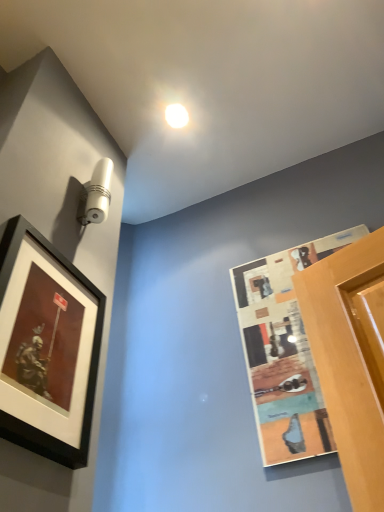
Where is `white glossy droplight at upper center`? This screenshot has height=512, width=384. white glossy droplight at upper center is located at coordinates [x=176, y=115].

The height and width of the screenshot is (512, 384). In order to click on wooden textured picture frame at right, acting as the 1th picture frame starting from the right in this screenshot , I will do `click(284, 351)`.

What is the approximate height of matte black picture frame at left, acting as the 2th picture frame starting from the right?

It is 46.22 centimeters.

The width and height of the screenshot is (384, 512). Find the location of `white glossy droplight at upper center`. white glossy droplight at upper center is located at coordinates (176, 115).

Can you confirm if white glossy droplight at upper center is thinner than wooden textured picture frame at right, acting as the 1th picture frame starting from the right?

No, white glossy droplight at upper center is not thinner than wooden textured picture frame at right, acting as the 1th picture frame starting from the right.

Can you confirm if white glossy droplight at upper center is smaller than wooden textured picture frame at right, which is the second picture frame in left-to-right order?

Yes.

Considering the positions of points (288, 290) and (75, 376), is point (288, 290) farther from camera compared to point (75, 376)?

Yes, it is behind point (75, 376).

Is wooden textured picture frame at right, which is the second picture frame in left-to-right order, shorter than matte black picture frame at left, which is the first picture frame from left to right?

In fact, wooden textured picture frame at right, which is the second picture frame in left-to-right order, may be taller than matte black picture frame at left, which is the first picture frame from left to right.

Between wooden textured picture frame at right, which is the second picture frame in left-to-right order, and matte black picture frame at left, which is the first picture frame from left to right, which one appears on the right side from the viewer's perspective?

From the viewer's perspective, wooden textured picture frame at right, which is the second picture frame in left-to-right order, appears more on the right side.

From the image's perspective, between wooden textured picture frame at right, acting as the 1th picture frame starting from the right, and white glossy droplight at upper center, who is located below?

From the image's view, wooden textured picture frame at right, acting as the 1th picture frame starting from the right, is below.

Can we say wooden textured picture frame at right, acting as the 1th picture frame starting from the right, lies outside white glossy droplight at upper center?

wooden textured picture frame at right, acting as the 1th picture frame starting from the right, lies outside white glossy droplight at upper center's area.

Locate an element on the screen. The image size is (384, 512). the 1st picture frame below the white glossy droplight at upper center (from a real-world perspective) is located at coordinates (284, 351).

From the picture: Could you tell me if white glossy droplight at upper center is turned towards matte black picture frame at left, acting as the 2th picture frame starting from the right?

No, white glossy droplight at upper center is not facing towards matte black picture frame at left, acting as the 2th picture frame starting from the right.

Is white glossy droplight at upper center bigger or smaller than matte black picture frame at left, which is the first picture frame from left to right?

In the image, white glossy droplight at upper center appears to be smaller than matte black picture frame at left, which is the first picture frame from left to right.

Which object is wider, white glossy droplight at upper center or matte black picture frame at left, acting as the 2th picture frame starting from the right?

white glossy droplight at upper center.

Are white glossy droplight at upper center and matte black picture frame at left, which is the first picture frame from left to right, far apart?

That's right, there is a large distance between white glossy droplight at upper center and matte black picture frame at left, which is the first picture frame from left to right.

Can you confirm if matte black picture frame at left, acting as the 2th picture frame starting from the right, is wider than wooden textured picture frame at right, which is the second picture frame in left-to-right order?

Correct, the width of matte black picture frame at left, acting as the 2th picture frame starting from the right, exceeds that of wooden textured picture frame at right, which is the second picture frame in left-to-right order.

Does point (84, 315) come behind point (295, 257)?

That is False.

Which of these two, matte black picture frame at left, acting as the 2th picture frame starting from the right, or wooden textured picture frame at right, acting as the 1th picture frame starting from the right, stands taller?

Standing taller between the two is wooden textured picture frame at right, acting as the 1th picture frame starting from the right.

From a real-world perspective, is matte black picture frame at left, which is the first picture frame from left to right, above or below wooden textured picture frame at right, which is the second picture frame in left-to-right order?

In terms of real-world spatial position, matte black picture frame at left, which is the first picture frame from left to right, is below wooden textured picture frame at right, which is the second picture frame in left-to-right order.

From a real-world perspective, relative to white glossy droplight at upper center, is matte black picture frame at left, acting as the 2th picture frame starting from the right, vertically above or below?

Clearly, from a real-world perspective, matte black picture frame at left, acting as the 2th picture frame starting from the right, is below white glossy droplight at upper center.

Is matte black picture frame at left, which is the first picture frame from left to right, oriented towards white glossy droplight at upper center?

No.

Find the location of a particular element. The image size is (384, 512). picture frame that is the 2nd object located in front of the white glossy droplight at upper center is located at coordinates (84, 370).

From the image's perspective, would you say matte black picture frame at left, which is the first picture frame from left to right, is shown under white glossy droplight at upper center?

Yes.

From the image's perspective, count 2nd picture frames downward from the white glossy droplight at upper center and point to it. Please provide its 2D coordinates.

[(284, 351)]

You are a GUI agent. You are given a task and a screenshot of the screen. Output one action in this format:
    pyautogui.click(x=<x>, y=<y>)
    Task: Click on the picture frame on the right of matte black picture frame at left, which is the first picture frame from left to right
    The height and width of the screenshot is (512, 384).
    Given the screenshot: What is the action you would take?
    pyautogui.click(x=284, y=351)

Which object lies nearer to the anchor point wooden textured picture frame at right, acting as the 1th picture frame starting from the right, white glossy droplight at upper center or matte black picture frame at left, which is the first picture frame from left to right?

matte black picture frame at left, which is the first picture frame from left to right, is positioned closer to the anchor wooden textured picture frame at right, acting as the 1th picture frame starting from the right.

From the image, which object appears to be farther from white glossy droplight at upper center, wooden textured picture frame at right, acting as the 1th picture frame starting from the right, or matte black picture frame at left, which is the first picture frame from left to right?

Based on the image, matte black picture frame at left, which is the first picture frame from left to right, appears to be further to white glossy droplight at upper center.

Looking at the image, which one is located further to wooden textured picture frame at right, acting as the 1th picture frame starting from the right, matte black picture frame at left, acting as the 2th picture frame starting from the right, or white glossy droplight at upper center?

→ white glossy droplight at upper center is further to wooden textured picture frame at right, acting as the 1th picture frame starting from the right.

When comparing their distances from matte black picture frame at left, which is the first picture frame from left to right, does wooden textured picture frame at right, acting as the 1th picture frame starting from the right, or white glossy droplight at upper center seem closer?

wooden textured picture frame at right, acting as the 1th picture frame starting from the right, lies closer to matte black picture frame at left, which is the first picture frame from left to right, than the other object.

Looking at the image, which one is located further to white glossy droplight at upper center, matte black picture frame at left, acting as the 2th picture frame starting from the right, or wooden textured picture frame at right, which is the second picture frame in left-to-right order?

matte black picture frame at left, acting as the 2th picture frame starting from the right, lies further to white glossy droplight at upper center than the other object.

When comparing their distances from matte black picture frame at left, acting as the 2th picture frame starting from the right, does white glossy droplight at upper center or wooden textured picture frame at right, which is the second picture frame in left-to-right order, seem closer?

Among the two, wooden textured picture frame at right, which is the second picture frame in left-to-right order, is located nearer to matte black picture frame at left, acting as the 2th picture frame starting from the right.

I want to click on picture frame located between matte black picture frame at left, which is the first picture frame from left to right, and white glossy droplight at upper center in the depth direction, so click(284, 351).